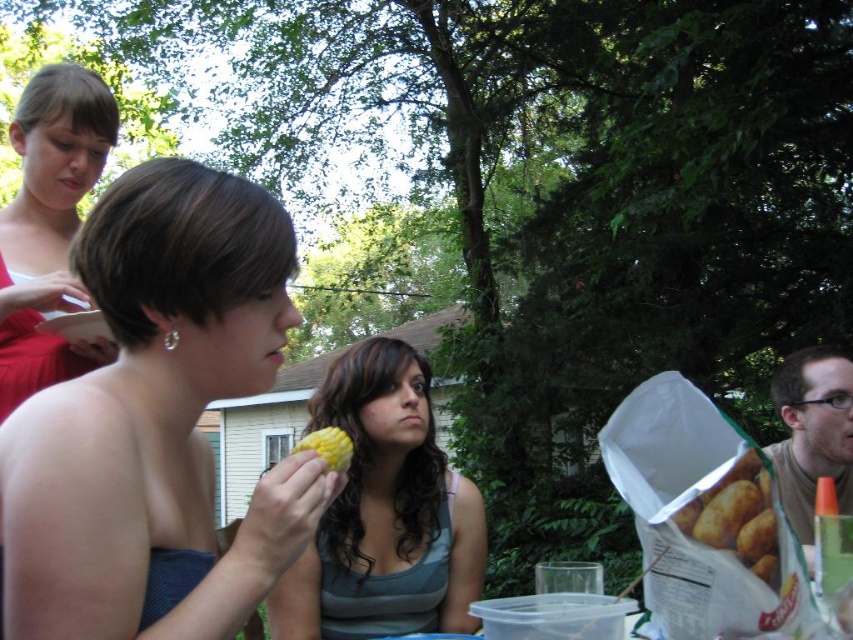
Find the location of a particular element. gray striped tank top at center is located at coordinates (384, 513).

What do you see at coordinates (384, 513) in the screenshot?
I see `gray striped tank top at center` at bounding box center [384, 513].

Where is `gray striped tank top at center`? gray striped tank top at center is located at coordinates (384, 513).

Can you confirm if matte yellow corn at center is positioned above matte brown hair at right?

Result: Correct, matte yellow corn at center is located above matte brown hair at right.

Image resolution: width=853 pixels, height=640 pixels. What are the coordinates of `matte yellow corn at center` in the screenshot? It's located at (155, 419).

Is matte yellow corn at center above matte brown potato at lower right?

Indeed, matte yellow corn at center is positioned over matte brown potato at lower right.

Identify the location of matte yellow corn at center. Image resolution: width=853 pixels, height=640 pixels. pyautogui.click(x=155, y=419).